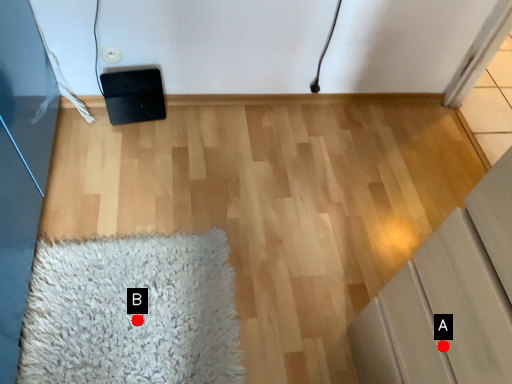
Question: Two points are circled on the image, labeled by A and B beside each circle. Among these points, which one is farthest from the camera?

Choices:
 (A) A is further
 (B) B is further

Answer: (B)